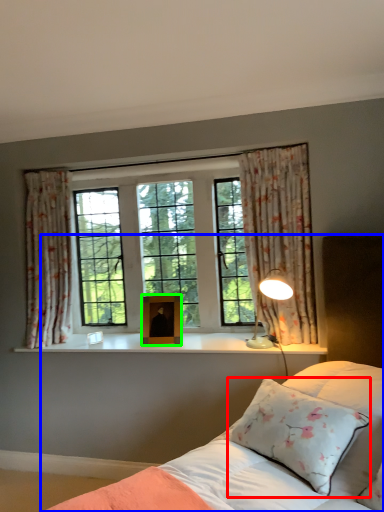
Question: Estimate the real-world distances between objects in this image. Which object is closer to pillow (highlighted by a red box), bed (highlighted by a blue box) or picture frame (highlighted by a green box)?

Choices:
 (A) bed
 (B) picture frame

Answer: (A)